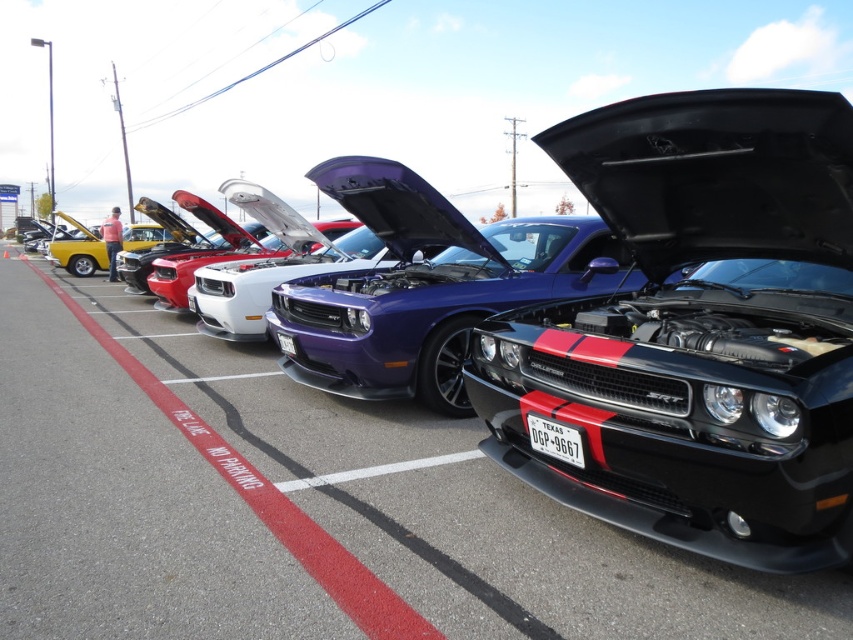
Can you confirm if black matte car at center is positioned to the left of shiny purple car at center?

No, black matte car at center is not to the left of shiny purple car at center.

Does black matte car at center have a larger size compared to shiny purple car at center?

Yes.

Does point (804, 308) come farther from viewer compared to point (564, 244)?

That is False.

The image size is (853, 640). I want to click on black matte car at center, so click(695, 332).

Does black matte car at center appear on the right side of red paint at center?

Yes, black matte car at center is to the right of red paint at center.

Who is more distant from viewer, (743, 262) or (347, 604)?

The point (743, 262) is more distant.

Does point (799, 417) come closer to viewer compared to point (229, 472)?

Yes.

Locate an element on the screen. black matte car at center is located at coordinates (695, 332).

Does shiny purple car at center have a greater width compared to red paint at center?

Incorrect, shiny purple car at center's width does not surpass red paint at center's.

Is shiny purple car at center to the right of red paint at center from the viewer's perspective?

Yes, shiny purple car at center is to the right of red paint at center.

This screenshot has height=640, width=853. Describe the element at coordinates (426, 285) in the screenshot. I see `shiny purple car at center` at that location.

In order to click on shiny purple car at center in this screenshot , I will do `click(426, 285)`.